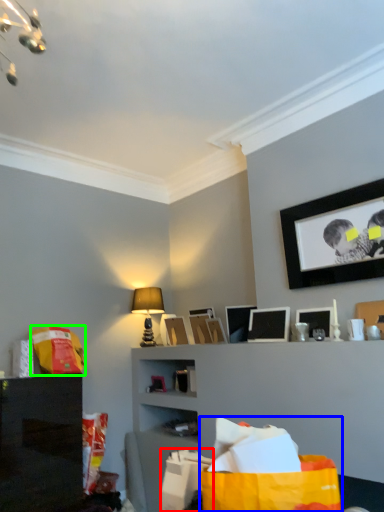
Question: Which object is the farthest from shopping bag (highlighted by a red box)? Choose among these: shopping bag (highlighted by a blue box) or shopping bag (highlighted by a green box).

Choices:
 (A) shopping bag
 (B) shopping bag

Answer: (B)